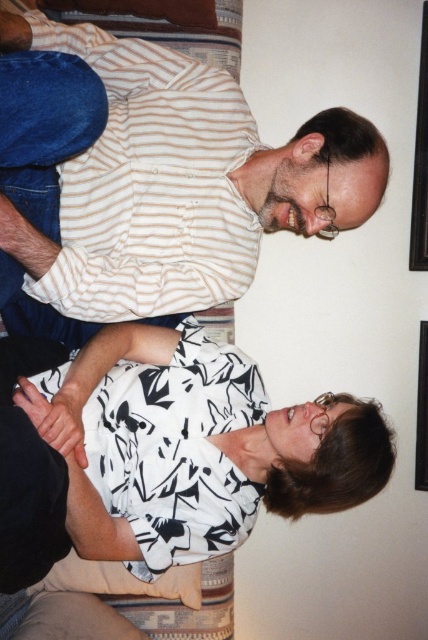
Who is lower down, white printed blouse at lower center or white striped shirt at upper center?

white printed blouse at lower center is below.

From the picture: Is white printed blouse at lower center shorter than white striped shirt at upper center?

Yes, white printed blouse at lower center is shorter than white striped shirt at upper center.

I want to click on white printed blouse at lower center, so click(x=166, y=451).

Who is positioned more to the right, white striped shirt at upper center or velvet blue bed at upper left?

Positioned to the right is white striped shirt at upper center.

Does white striped shirt at upper center come behind velvet blue bed at upper left?

That is False.

Which is behind, point (20, 35) or point (148, 4)?

Positioned behind is point (148, 4).

Identify the location of white striped shirt at upper center. This screenshot has width=428, height=640. (180, 182).

Does white printed blouse at lower center have a larger size compared to velvet blue bed at upper left?

Yes.

Between white printed blouse at lower center and velvet blue bed at upper left, which one appears on the left side from the viewer's perspective?

velvet blue bed at upper left

This screenshot has height=640, width=428. What do you see at coordinates (166, 451) in the screenshot? I see `white printed blouse at lower center` at bounding box center [166, 451].

Where is `white printed blouse at lower center`? The image size is (428, 640). white printed blouse at lower center is located at coordinates click(166, 451).